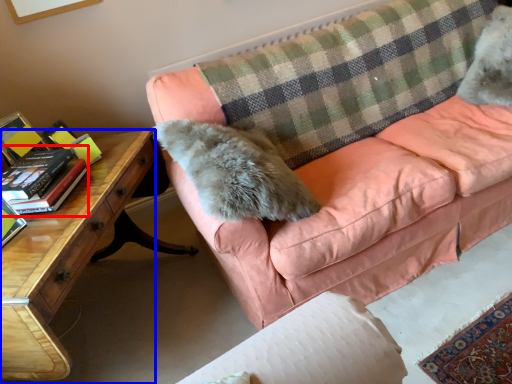
Question: Which of the following is the closest to the observer, paperback book (highlighted by a red box) or desk (highlighted by a blue box)?

Choices:
 (A) paperback book
 (B) desk

Answer: (B)